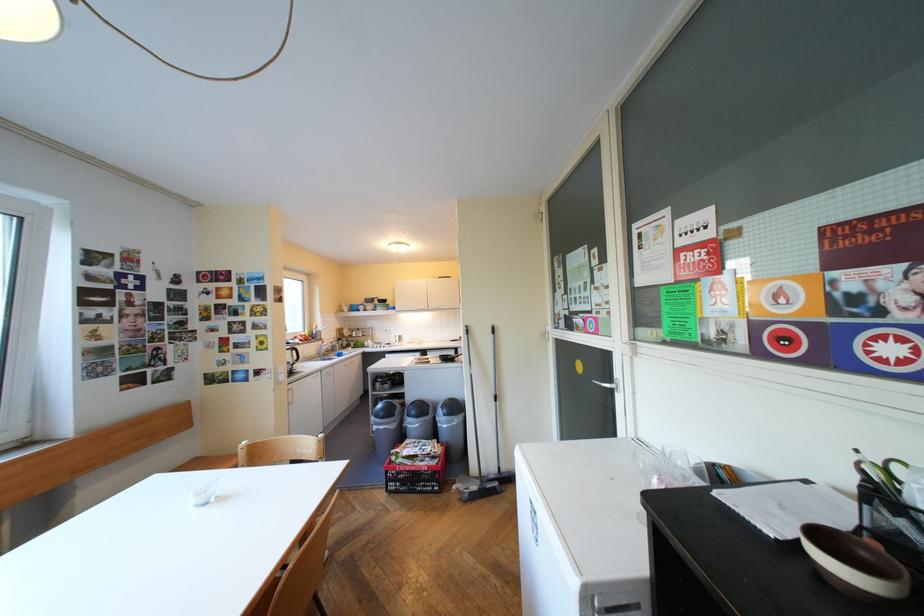
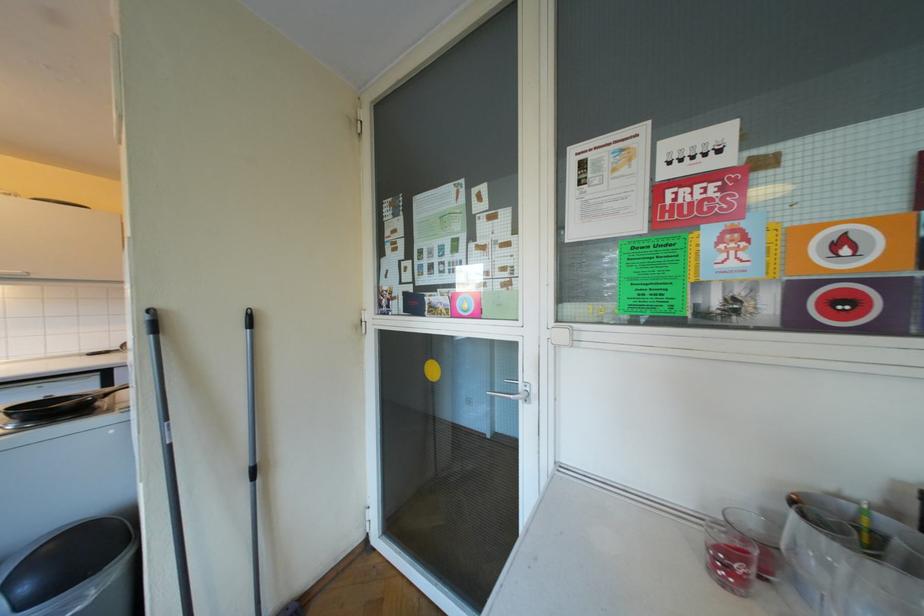
The point at (x=457, y=414) is marked in the first image. Where is the corresponding point in the second image?

(40, 602)